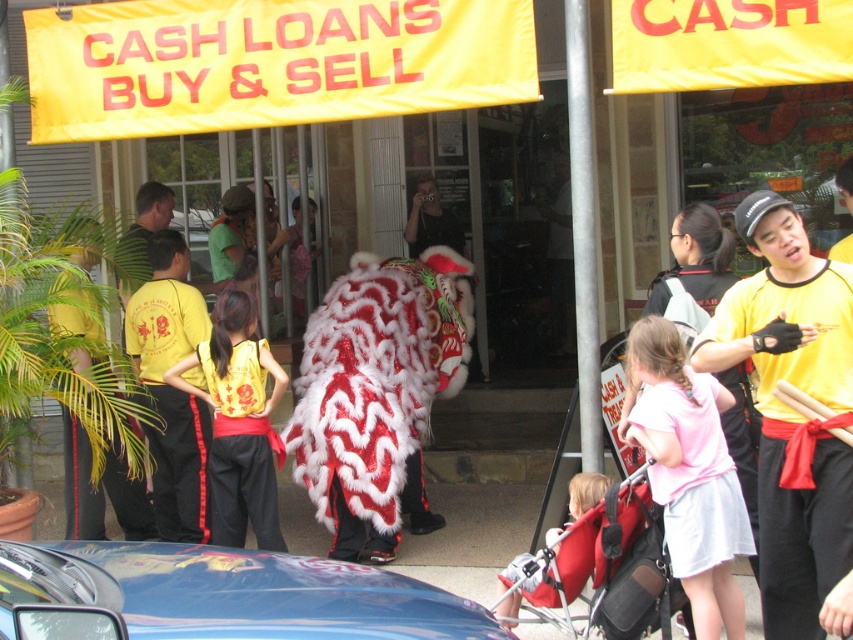
Is point (840, 401) behind point (659, 577)?

No, (840, 401) is in front of (659, 577).

I want to click on yellow matte shirt at center, so click(x=793, y=416).

Where is `yellow matte shirt at center`? Image resolution: width=853 pixels, height=640 pixels. yellow matte shirt at center is located at coordinates pyautogui.click(x=793, y=416).

What are the coordinates of `yellow matte shirt at center` in the screenshot? It's located at (793, 416).

Who is taller, red fabric stroller at lower center or black satin vest at center?

black satin vest at center

Does red fabric stroller at lower center have a lesser height compared to black satin vest at center?

Indeed, red fabric stroller at lower center has a lesser height compared to black satin vest at center.

At what (x,y) coordinates should I click in order to perform the action: click on red fabric stroller at lower center. Please return your answer as a coordinate pair (x, y). This screenshot has width=853, height=640. Looking at the image, I should click on (606, 564).

Locate an element on the screen. Image resolution: width=853 pixels, height=640 pixels. red fabric stroller at lower center is located at coordinates (606, 564).

From the picture: Does yellow fabric banner at upper center come in front of red fabric stroller at lower center?

No, it is not.

Can you confirm if yellow fabric banner at upper center is thinner than red fabric stroller at lower center?

Incorrect, yellow fabric banner at upper center's width is not less than red fabric stroller at lower center's.

Does point (479, 54) lie behind point (605, 547)?

Yes, point (479, 54) is behind point (605, 547).

At what (x,y) coordinates should I click in order to perform the action: click on yellow fabric banner at upper center. Please return your answer as a coordinate pair (x, y). Looking at the image, I should click on (270, 61).